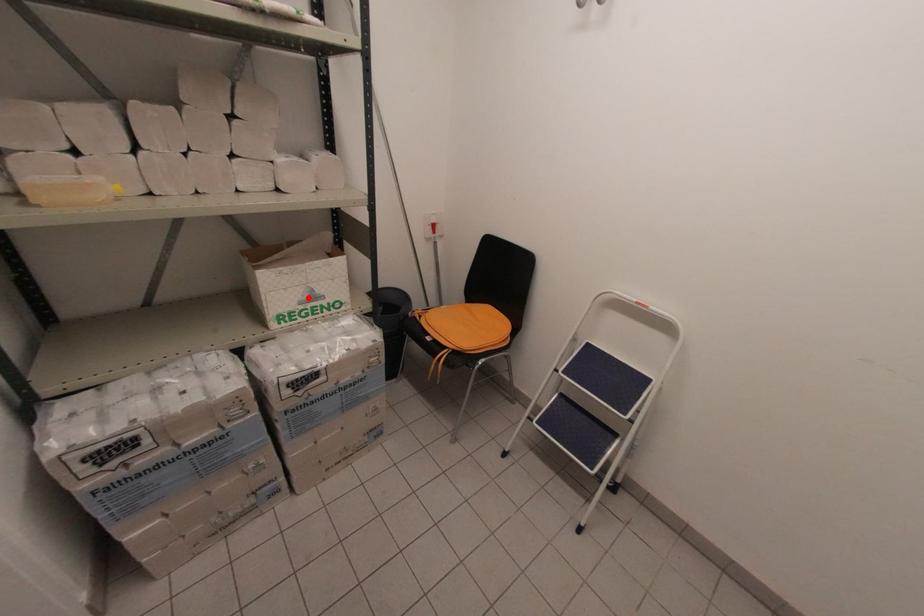
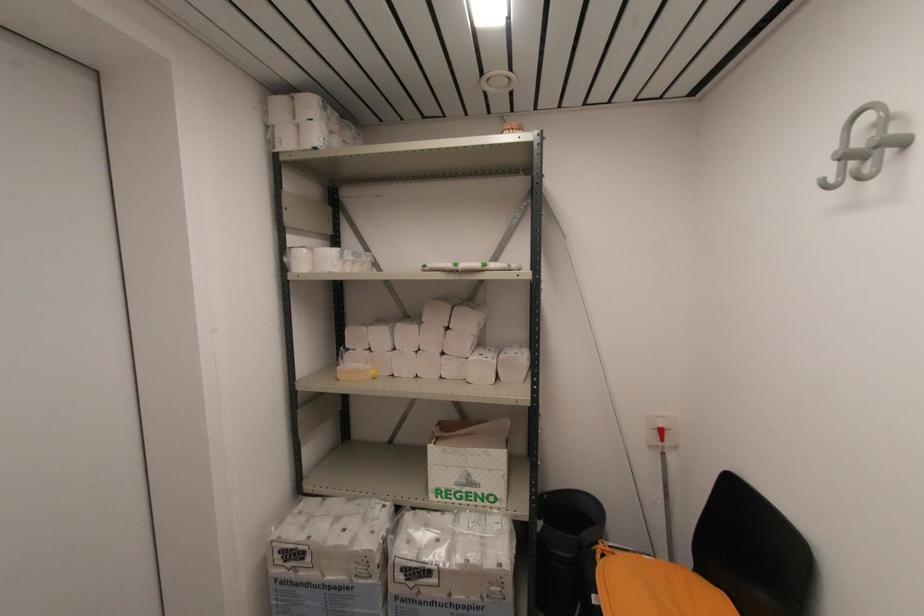
Question: I am providing you with two images of the same scene from different viewpoints. Image1 has a red point marked. In image2, the corresponding 3D location appears at what relative position? Reply with the corresponding letter.

Choices:
 (A) Closer
 (B) Farther

Answer: (B)